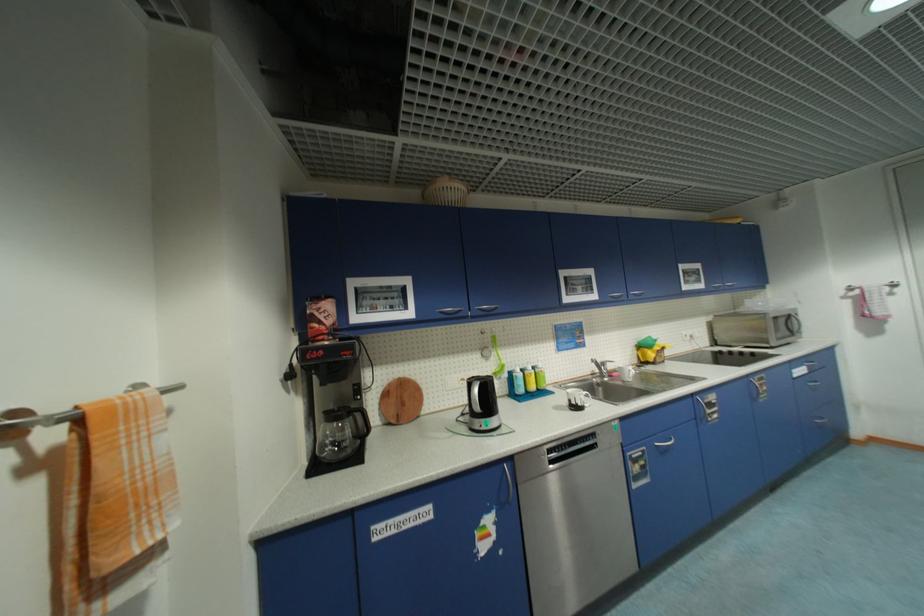
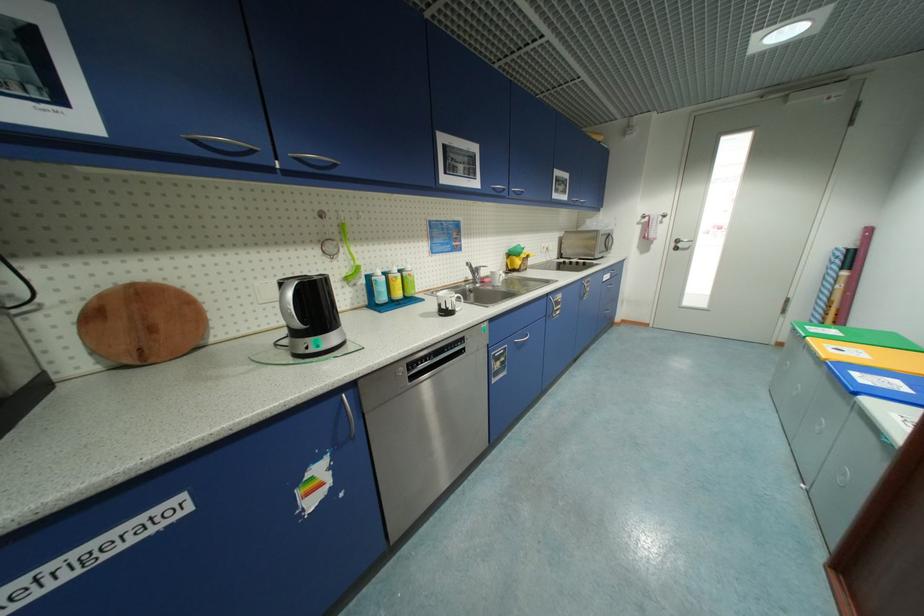
Locate, in the second image, the point that corresponds to point (704, 419) in the first image.

(553, 315)